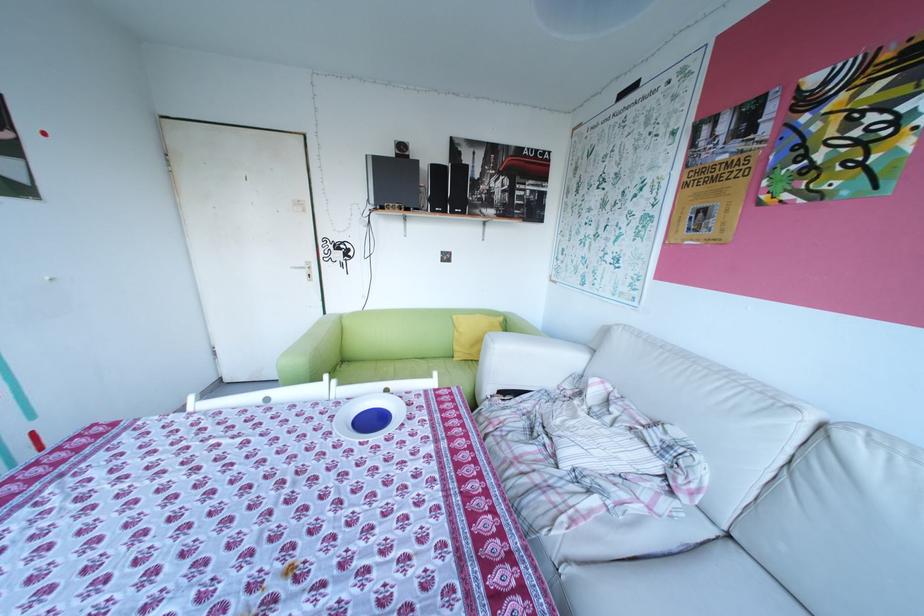
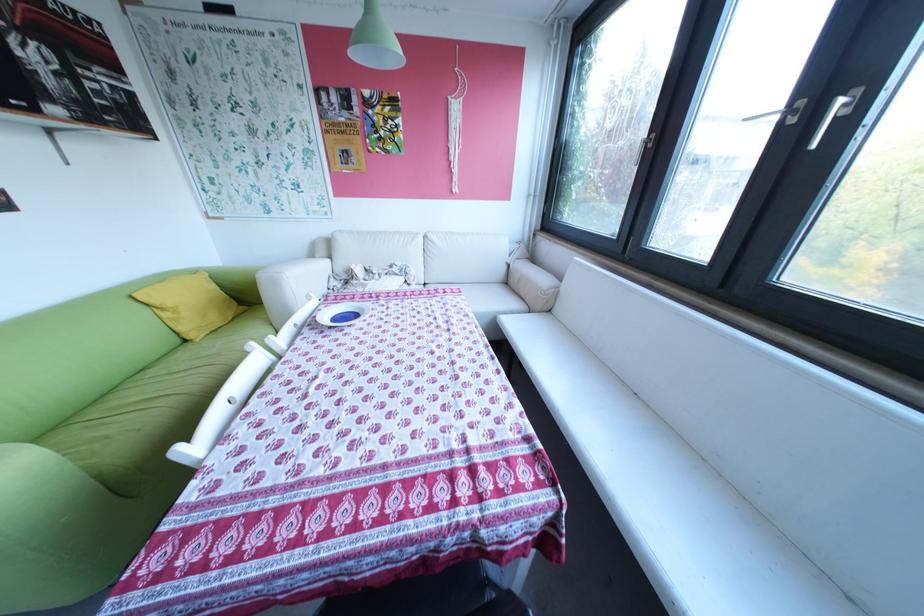
The point at [468,334] is marked in the first image. Where is the corresponding point in the second image?

(177, 314)